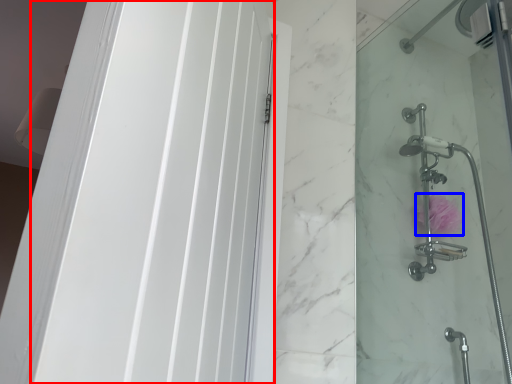
Question: Which point is further to the camera, screen door (highlighted by a red box) or flower (highlighted by a blue box)?

Choices:
 (A) screen door
 (B) flower

Answer: (B)